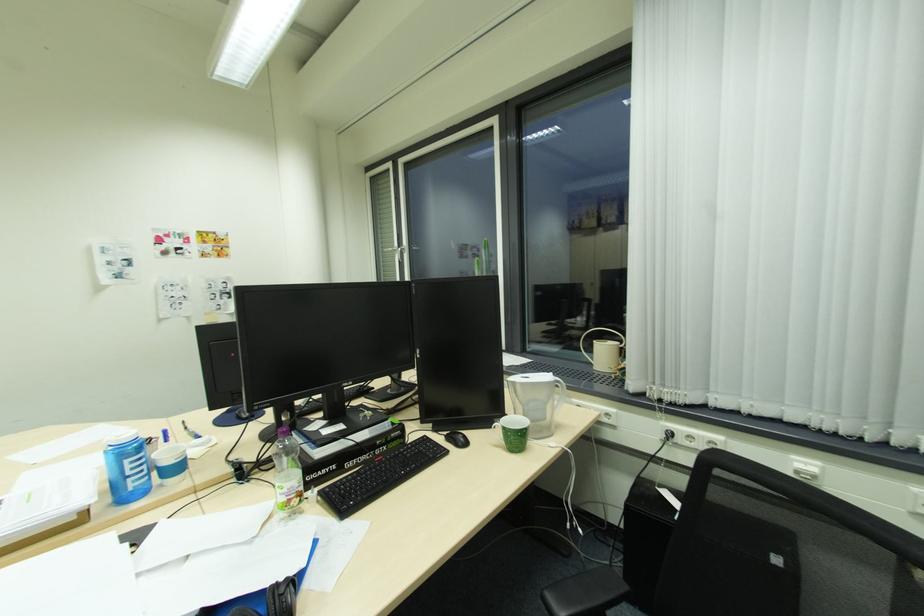
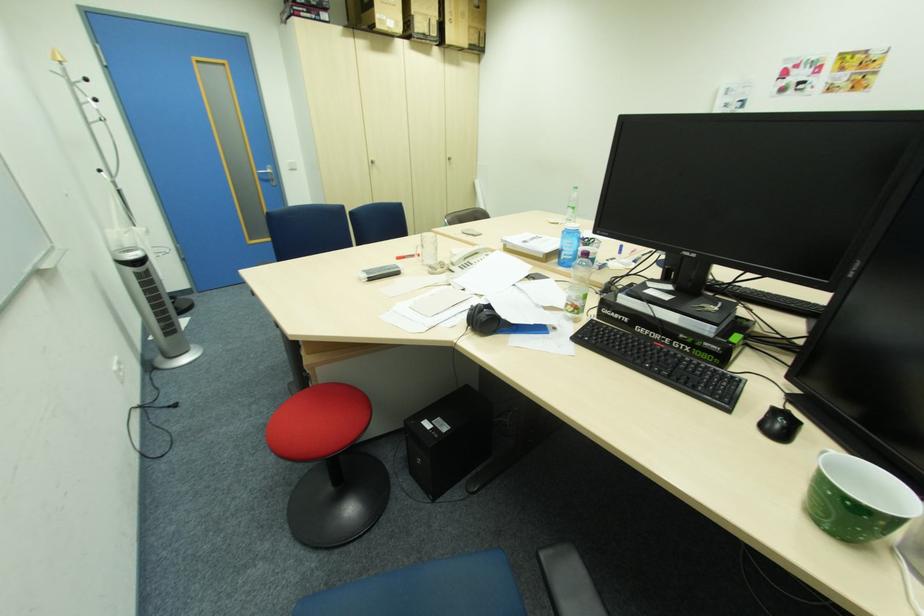
The point at (298,496) is marked in the first image. Where is the corresponding point in the second image?

(575, 304)